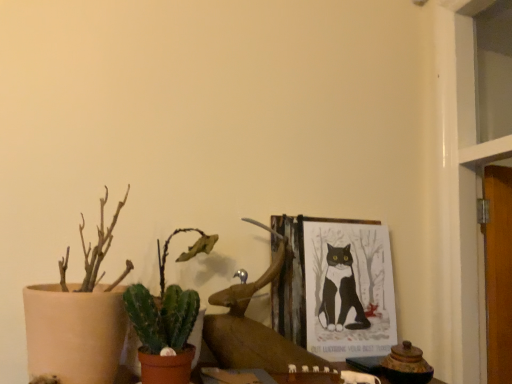
The width and height of the screenshot is (512, 384). I want to click on green succulent at lower left, so click(162, 316).

The image size is (512, 384). I want to click on matte beige pot at left, the first houseplant from the left, so click(78, 318).

The image size is (512, 384). Find the location of `green matte cactus at lower left, the 2th houseplant positioned from the left`. green matte cactus at lower left, the 2th houseplant positioned from the left is located at coordinates (166, 319).

What's the angular difference between wooden picture frame at upper center and green succulent at lower left's facing directions?

1.2 degrees.

Is wooden picture frame at upper center oriented towards green succulent at lower left?

No, wooden picture frame at upper center does not turn towards green succulent at lower left.

Considering the relative sizes of wooden picture frame at upper center and green succulent at lower left in the image provided, is wooden picture frame at upper center wider than green succulent at lower left?

Incorrect, the width of wooden picture frame at upper center does not surpass that of green succulent at lower left.

Is wooden picture frame at upper center taller or shorter than green succulent at lower left?

In the image, wooden picture frame at upper center appears to be taller than green succulent at lower left.

Between green succulent at lower left and wooden picture frame at upper center, which one has larger width?

With larger width is green succulent at lower left.

How different are the orientations of green succulent at lower left and wooden picture frame at upper center in degrees?

The angular difference between green succulent at lower left and wooden picture frame at upper center is 1.2 degrees.

Is green succulent at lower left taller than wooden picture frame at upper center?

In fact, green succulent at lower left may be shorter than wooden picture frame at upper center.

From the image's perspective, between green succulent at lower left and wooden picture frame at upper center, who is located below?

green succulent at lower left appears lower in the image.

How far apart are matte beige pot at left, the first houseplant from the left, and green succulent at lower left?

matte beige pot at left, the first houseplant from the left, and green succulent at lower left are 4.61 inches apart.

Considering the positions of point (68, 355) and point (130, 309), is point (68, 355) closer or farther from the camera than point (130, 309)?

Clearly, point (68, 355) is closer to the camera than point (130, 309).

Considering the positions of objects matte beige pot at left, the second houseplant from the right, and green succulent at lower left in the image provided, who is more to the left, matte beige pot at left, the second houseplant from the right, or green succulent at lower left?

matte beige pot at left, the second houseplant from the right.

From the image's perspective, is matte beige pot at left, the first houseplant from the left, above or below green succulent at lower left?

From the image's perspective, matte beige pot at left, the first houseplant from the left, appears above green succulent at lower left.

Which object is closer to the camera, wooden picture frame at upper center or green matte cactus at lower left, the 2th houseplant positioned from the left?

green matte cactus at lower left, the 2th houseplant positioned from the left, is more forward.

The height and width of the screenshot is (384, 512). I want to click on the 1st houseplant in front of the wooden picture frame at upper center, so click(x=166, y=319).

Is wooden picture frame at upper center in contact with green matte cactus at lower left, marked as the first houseplant in a right-to-left arrangement?

No, wooden picture frame at upper center is not with green matte cactus at lower left, marked as the first houseplant in a right-to-left arrangement.

From the image's perspective, does wooden picture frame at upper center appear lower than green matte cactus at lower left, marked as the first houseplant in a right-to-left arrangement?

Yes.

Looking at this image, which of these two, matte beige pot at left, the second houseplant from the right, or wooden picture frame at upper center, is wider?

matte beige pot at left, the second houseplant from the right, is wider.

Can you confirm if matte beige pot at left, the first houseplant from the left, is smaller than wooden picture frame at upper center?

Actually, matte beige pot at left, the first houseplant from the left, might be larger than wooden picture frame at upper center.

Considering the relative positions of matte beige pot at left, the second houseplant from the right, and wooden picture frame at upper center in the image provided, is matte beige pot at left, the second houseplant from the right, to the left of wooden picture frame at upper center from the viewer's perspective?

Yes, matte beige pot at left, the second houseplant from the right, is to the left of wooden picture frame at upper center.

Which point is more forward, (109, 314) or (317, 218)?

The point (109, 314) is closer.

From the image's perspective, which object appears higher, green matte cactus at lower left, marked as the first houseplant in a right-to-left arrangement, or matte beige pot at left, the second houseplant from the right?

From the image's view, matte beige pot at left, the second houseplant from the right, is above.

Between green matte cactus at lower left, the 2th houseplant positioned from the left, and matte beige pot at left, the first houseplant from the left, which one has larger width?

matte beige pot at left, the first houseplant from the left.

This screenshot has height=384, width=512. I want to click on houseplant above the green matte cactus at lower left, the 2th houseplant positioned from the left (from a real-world perspective), so click(x=78, y=318).

Who is bigger, green succulent at lower left or matte beige pot at left, the first houseplant from the left?

matte beige pot at left, the first houseplant from the left.

Is green succulent at lower left wider than matte beige pot at left, the second houseplant from the right?

Incorrect, the width of green succulent at lower left does not surpass that of matte beige pot at left, the second houseplant from the right.

In the image, there is a matte beige pot at left, the first houseplant from the left. Identify the location of plant below it (from a real-world perspective). (162, 316).

How different are the orientations of green succulent at lower left and matte beige pot at left, the second houseplant from the right, in degrees?

2.72 degrees separate the facing orientations of green succulent at lower left and matte beige pot at left, the second houseplant from the right.

Where is `picture frame above the green succulent at lower left (from the image's perspective)`? picture frame above the green succulent at lower left (from the image's perspective) is located at coordinates (348, 288).

This screenshot has width=512, height=384. I want to click on picture frame on the right of green succulent at lower left, so click(x=348, y=288).

Considering their positions, is green succulent at lower left positioned further to wooden picture frame at upper center than green matte cactus at lower left, the 2th houseplant positioned from the left?

The object further to wooden picture frame at upper center is green succulent at lower left.

Which object lies nearer to the anchor point green matte cactus at lower left, the 2th houseplant positioned from the left, matte beige pot at left, the second houseplant from the right, or green succulent at lower left?

green succulent at lower left lies closer to green matte cactus at lower left, the 2th houseplant positioned from the left, than the other object.

From the image, which object appears to be farther from green matte cactus at lower left, marked as the first houseplant in a right-to-left arrangement, wooden picture frame at upper center or green succulent at lower left?

wooden picture frame at upper center.

When comparing their distances from green succulent at lower left, does green matte cactus at lower left, the 2th houseplant positioned from the left, or wooden picture frame at upper center seem closer?

green matte cactus at lower left, the 2th houseplant positioned from the left, lies closer to green succulent at lower left than the other object.

Looking at the image, which one is located further to green succulent at lower left, wooden picture frame at upper center or green matte cactus at lower left, the 2th houseplant positioned from the left?

wooden picture frame at upper center.

Which object lies further to the anchor point green succulent at lower left, matte beige pot at left, the second houseplant from the right, or wooden picture frame at upper center?

Among the two, wooden picture frame at upper center is located further to green succulent at lower left.

Looking at the image, which one is located further to wooden picture frame at upper center, green succulent at lower left or matte beige pot at left, the first houseplant from the left?

matte beige pot at left, the first houseplant from the left.

Considering their positions, is matte beige pot at left, the second houseplant from the right, positioned closer to green succulent at lower left than green matte cactus at lower left, marked as the first houseplant in a right-to-left arrangement?

The object closer to green succulent at lower left is green matte cactus at lower left, marked as the first houseplant in a right-to-left arrangement.

Where is `houseplant located between matte beige pot at left, the second houseplant from the right, and wooden picture frame at upper center in the left-right direction`? houseplant located between matte beige pot at left, the second houseplant from the right, and wooden picture frame at upper center in the left-right direction is located at coordinates (166, 319).

What are the coordinates of `plant between matte beige pot at left, the first houseplant from the left, and wooden picture frame at upper center, in the horizontal direction` in the screenshot? It's located at (162, 316).

Where is `plant between green matte cactus at lower left, marked as the first houseplant in a right-to-left arrangement, and wooden picture frame at upper center from left to right`? The height and width of the screenshot is (384, 512). plant between green matte cactus at lower left, marked as the first houseplant in a right-to-left arrangement, and wooden picture frame at upper center from left to right is located at coordinates pos(162,316).

At what (x,y) coordinates should I click in order to perform the action: click on plant between matte beige pot at left, the first houseplant from the left, and green matte cactus at lower left, marked as the first houseplant in a right-to-left arrangement, along the z-axis. Please return your answer as a coordinate pair (x, y). Looking at the image, I should click on [162, 316].